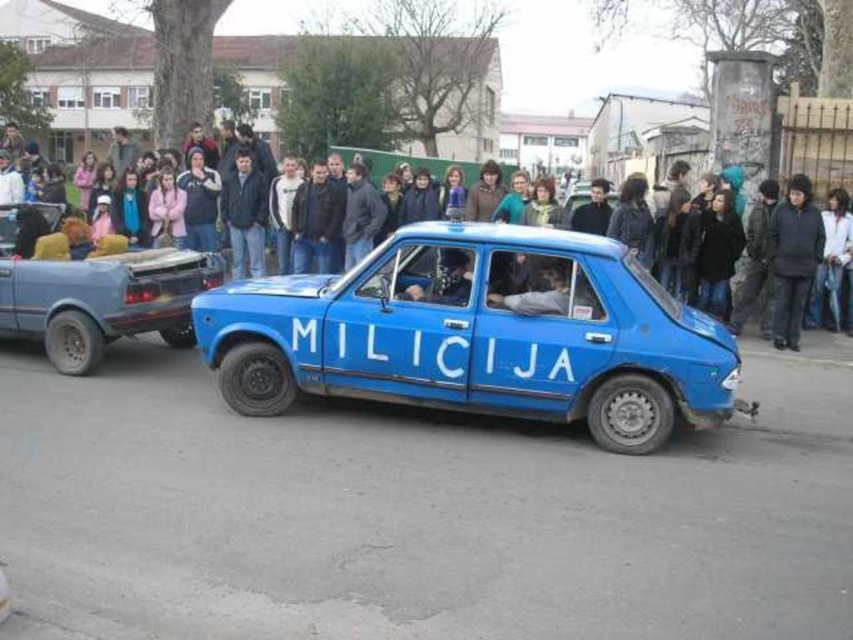
Question: Is blue matte car at center positioned behind rusty metal pickup truck at left?

Choices:
 (A) no
 (B) yes

Answer: (A)

Question: Estimate the real-world distances between objects in this image. Which object is closer to the blue matte car at center?

Choices:
 (A) dark blue clothing at center
 (B) rusty metal pickup truck at left

Answer: (B)

Question: Does blue matte car at center have a greater width compared to dark blue clothing at center?

Choices:
 (A) yes
 (B) no

Answer: (B)

Question: Which of the following is the closest to the observer?

Choices:
 (A) (422, 401)
 (B) (158, 272)

Answer: (A)

Question: Observing the image, what is the correct spatial positioning of blue matte car at center in reference to rusty metal pickup truck at left?

Choices:
 (A) above
 (B) below

Answer: (B)

Question: Considering the real-world distances, which object is closest to the rusty metal pickup truck at left?

Choices:
 (A) dark blue clothing at center
 (B) blue matte car at center

Answer: (B)